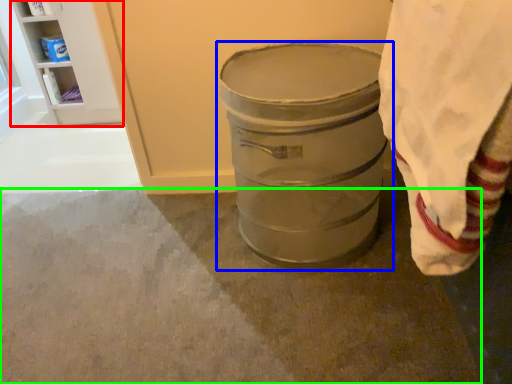
Question: Based on their relative distances, which object is farther from shelf (highlighted by a red box)? Choose from waste container (highlighted by a blue box) and concrete (highlighted by a green box).

Choices:
 (A) waste container
 (B) concrete

Answer: (A)